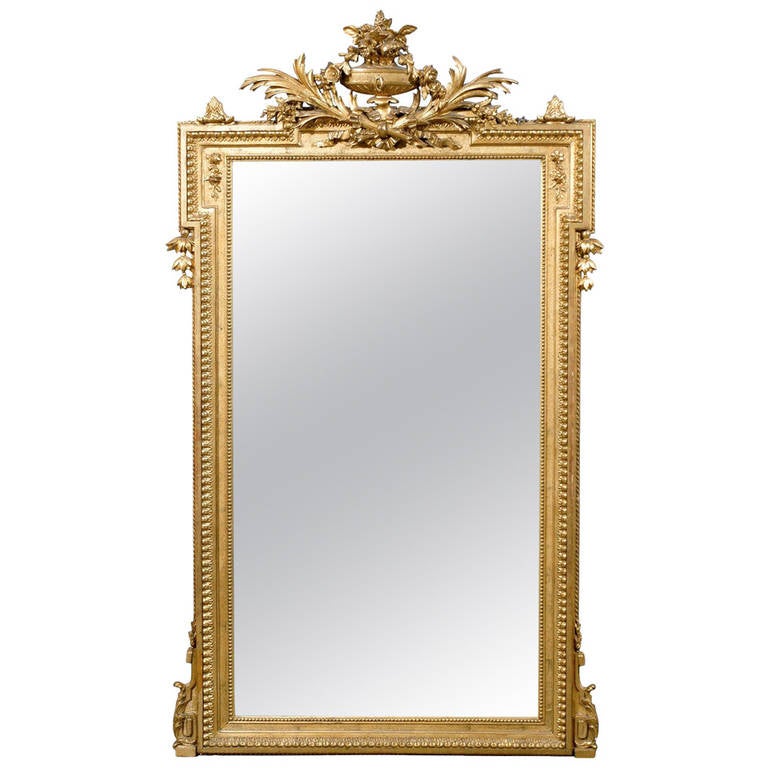
The width and height of the screenshot is (768, 768). I want to click on vase or cup at the top, so click(381, 83).